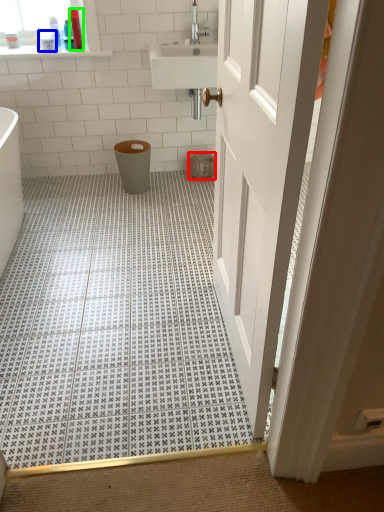
Question: Which object is positioned farthest from toilet paper (highlighted by a red box)? Select from toiletry (highlighted by a blue box) and toiletry (highlighted by a green box).

Choices:
 (A) toiletry
 (B) toiletry

Answer: (A)